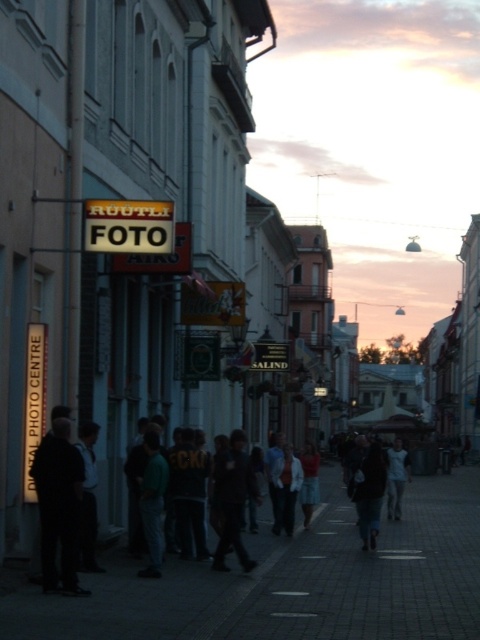
Question: Which point appears closest to the camera in this image?

Choices:
 (A) (39, 468)
 (B) (394, 492)
 (C) (346, 552)

Answer: (A)

Question: Which object is positioned closest to the dark gray concrete sidewalk at center?

Choices:
 (A) light blue fabric dress at center
 (B) dark fabric pants at left
 (C) pastel pink sky at upper center

Answer: (A)

Question: Which of these objects is positioned closest to the pastel pink sky at upper center?

Choices:
 (A) dark gray concrete sidewalk at center
 (B) light blue fabric dress at center
 (C) dark blue jeans at center
 (D) dark fabric pants at left

Answer: (A)

Question: Is dark gray concrete sidewalk at center closer to camera compared to light blue fabric dress at center?

Choices:
 (A) yes
 (B) no

Answer: (A)

Question: Can you confirm if dark gray concrete sidewalk at center is positioned to the right of dark fabric pants at left?

Choices:
 (A) yes
 (B) no

Answer: (A)

Question: Considering the relative positions of dark gray concrete sidewalk at center and dark blue jeans at center in the image provided, where is dark gray concrete sidewalk at center located with respect to dark blue jeans at center?

Choices:
 (A) above
 (B) below

Answer: (B)